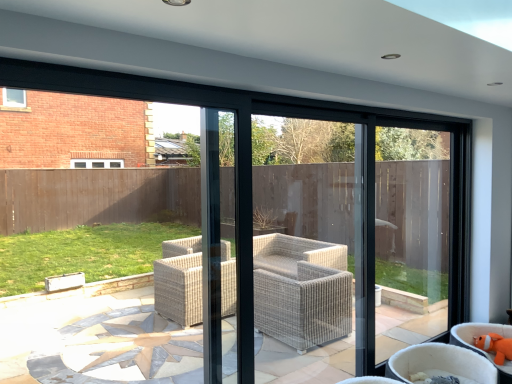
Question: Considering the relative sizes of orange plush toy at lower right, which is the 2th chair from left to right, and orange plush toy at lower right in the image provided, is orange plush toy at lower right, which is the 2th chair from left to right, bigger than orange plush toy at lower right?

Choices:
 (A) no
 (B) yes

Answer: (B)

Question: Is the position of orange plush toy at lower right, positioned as the 1th chair in right-to-left order, more distant than that of orange plush toy at lower right?

Choices:
 (A) yes
 (B) no

Answer: (B)

Question: Are orange plush toy at lower right, positioned as the 1th chair in right-to-left order, and orange plush toy at lower right located far from each other?

Choices:
 (A) no
 (B) yes

Answer: (A)

Question: Is orange plush toy at lower right, positioned as the 1th chair in right-to-left order, positioned in front of orange plush toy at lower right?

Choices:
 (A) yes
 (B) no

Answer: (A)

Question: Is the surface of orange plush toy at lower right, which is the 2th chair from left to right, in direct contact with orange plush toy at lower right?

Choices:
 (A) yes
 (B) no

Answer: (A)

Question: Could you tell me if orange plush toy at lower right, which is the 2th chair from left to right, is facing orange plush toy at lower right?

Choices:
 (A) yes
 (B) no

Answer: (B)

Question: Is orange plush toy at lower right to the left of beige wicker chair at lower right, which ranks as the second chair in right-to-left order, from the viewer's perspective?

Choices:
 (A) yes
 (B) no

Answer: (B)

Question: Does orange plush toy at lower right come behind beige wicker chair at lower right, which ranks as the second chair in right-to-left order?

Choices:
 (A) no
 (B) yes

Answer: (B)

Question: Is orange plush toy at lower right beside beige wicker chair at lower right, which is counted as the 1th chair, starting from the left?

Choices:
 (A) no
 (B) yes

Answer: (A)

Question: Can you confirm if orange plush toy at lower right is taller than beige wicker chair at lower right, which is counted as the 1th chair, starting from the left?

Choices:
 (A) yes
 (B) no

Answer: (B)

Question: Are orange plush toy at lower right and beige wicker chair at lower right, which ranks as the second chair in right-to-left order, located far from each other?

Choices:
 (A) no
 (B) yes

Answer: (A)

Question: Is orange plush toy at lower right bigger than beige wicker chair at lower right, which is counted as the 1th chair, starting from the left?

Choices:
 (A) no
 (B) yes

Answer: (A)

Question: Can you confirm if orange plush toy at lower right, which is the 2th chair from left to right, is bigger than beige wicker chair at lower right, which ranks as the second chair in right-to-left order?

Choices:
 (A) yes
 (B) no

Answer: (B)